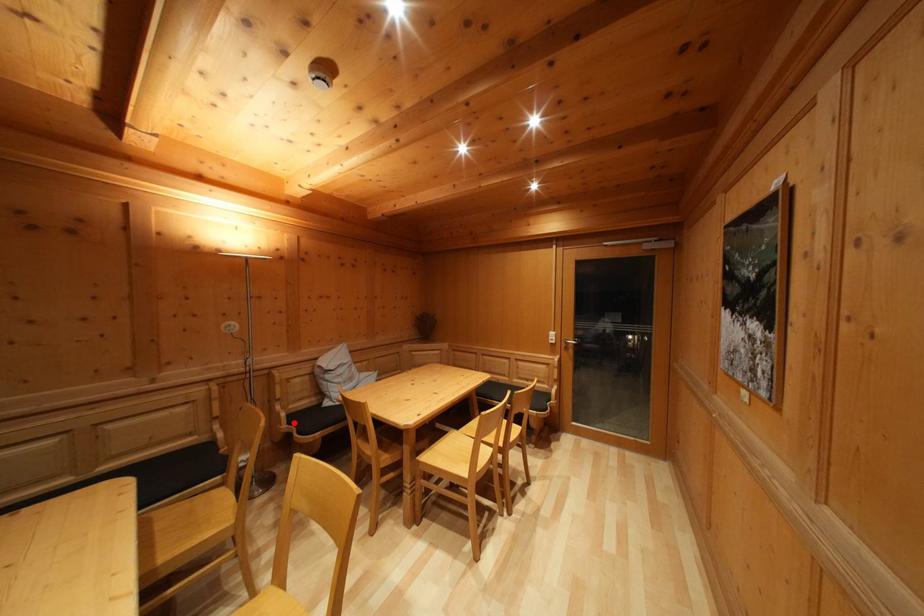
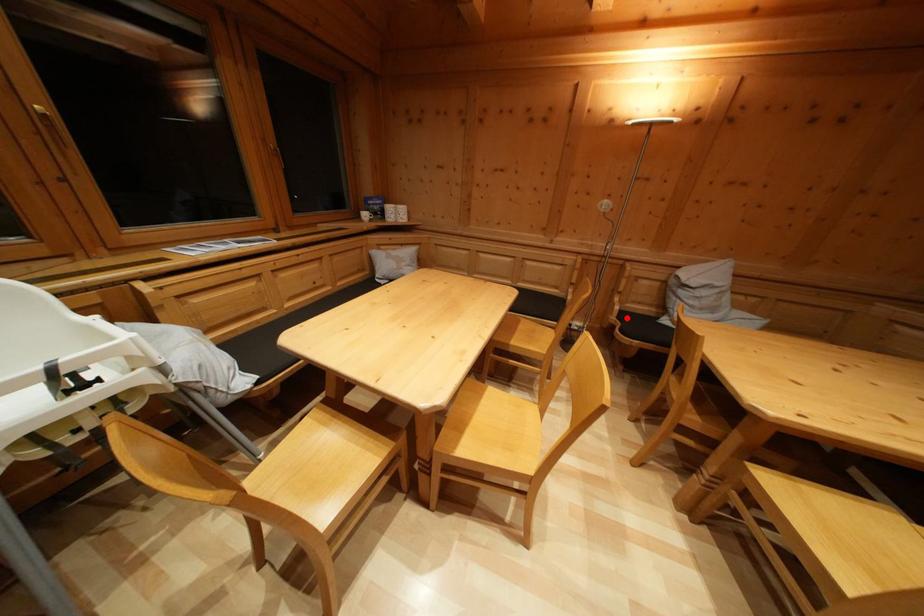
I am providing you with two images of the same scene from different viewpoints. A red point is marked on the first image and another point is marked on the second image. Are the points marked in image1 and image2 representing the same 3D position?

Yes